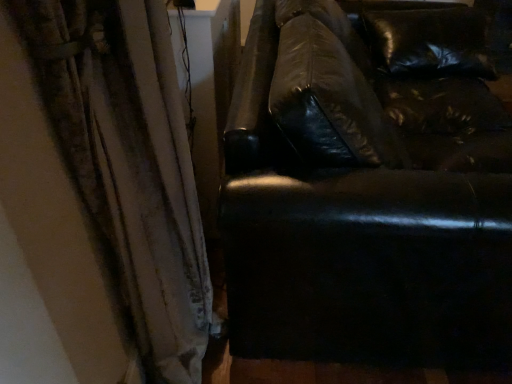
Question: Considering the positions of shiny black leather couch at right and white textured curtain at left in the image, is shiny black leather couch at right wider or thinner than white textured curtain at left?

Choices:
 (A) wide
 (B) thin

Answer: (A)

Question: Is shiny black leather couch at right to the left or to the right of white textured curtain at left in the image?

Choices:
 (A) left
 (B) right

Answer: (B)

Question: Does point 348,268 appear closer or farther from the camera than point 181,261?

Choices:
 (A) closer
 (B) farther

Answer: (A)

Question: In terms of width, does white textured curtain at left look wider or thinner when compared to shiny black leather couch at right?

Choices:
 (A) thin
 (B) wide

Answer: (A)

Question: Considering the positions of white textured curtain at left and shiny black leather couch at right in the image, is white textured curtain at left taller or shorter than shiny black leather couch at right?

Choices:
 (A) tall
 (B) short

Answer: (A)

Question: Based on their sizes in the image, would you say white textured curtain at left is bigger or smaller than shiny black leather couch at right?

Choices:
 (A) big
 (B) small

Answer: (B)

Question: Is white textured curtain at left inside or outside of shiny black leather couch at right?

Choices:
 (A) inside
 (B) outside

Answer: (B)